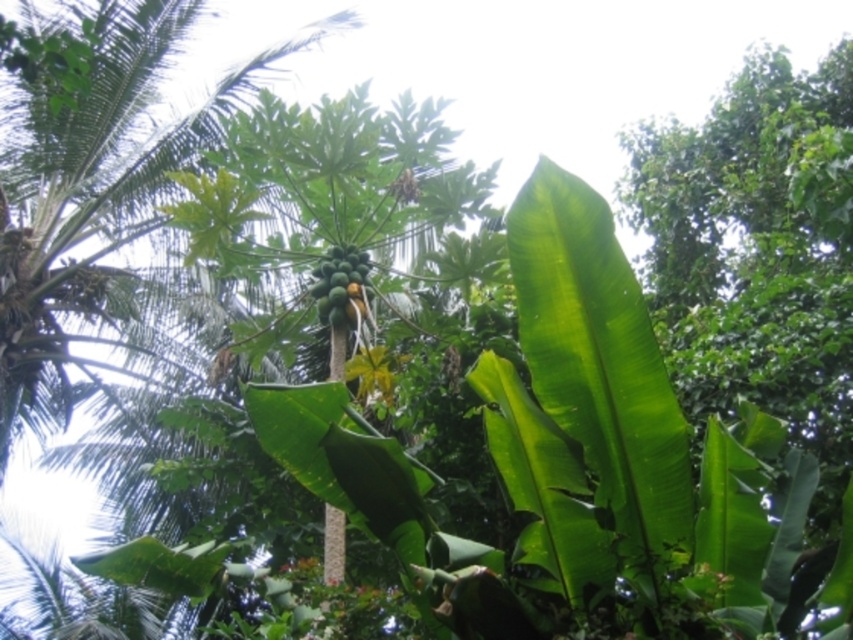
In the scene shown: You are a gardener who needs to water both the green leafy palm tree at center and the green matte papaya at center. If your watering can holds enough water for 8 meters of travel, can you water both plants without refilling?

The distance between the green leafy palm tree at center and the green matte papaya at center is 7.60 meters. Since the watering can can hold enough for 8 meters of travel, you can water both plants without needing to refill.

You are a botanist studying tropical plants. You observe a green leafy palm tree at center and a green matte coconut tree at center in the scene. Which of these two trees is located to the left of the other?

The green leafy palm tree at center is positioned on the left side of green matte coconut tree at center.

You are a horticulturist examining the tropical scene. You need to determine which plant is shorter between the green matte coconut tree at center and the green matte papaya at center. Which one is shorter?

The green matte coconut tree at center is shorter than the green matte papaya at center.